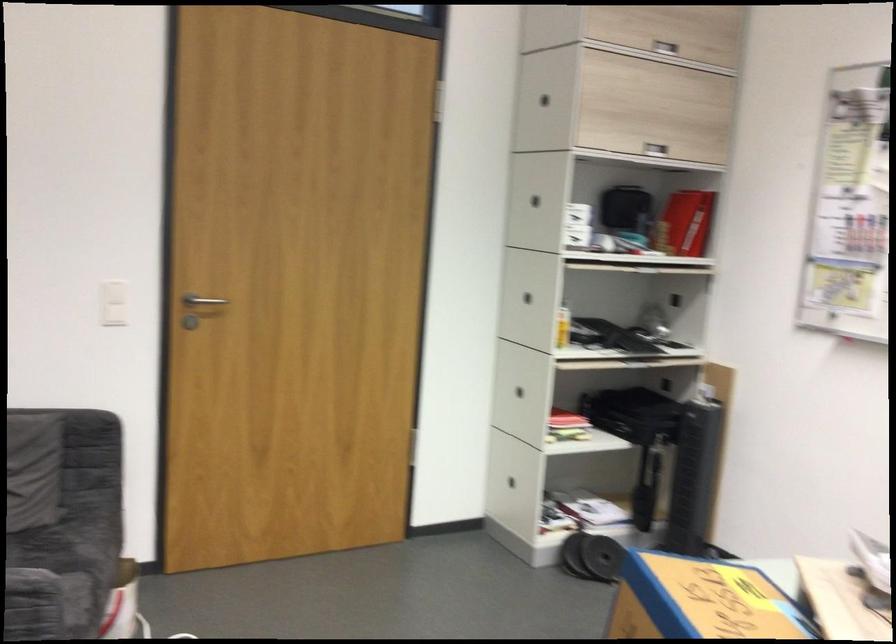
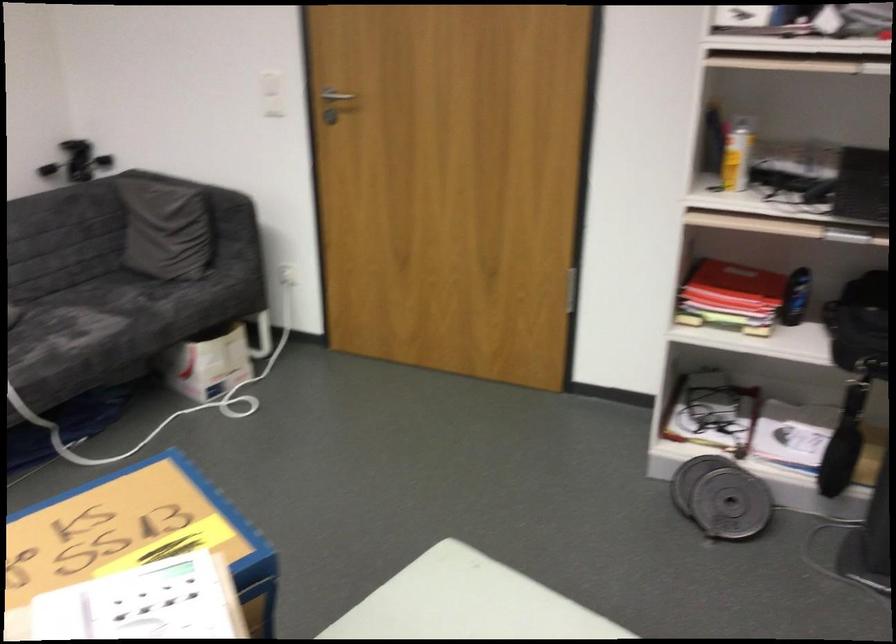
Where in the second image is the point corresponding to (588,411) from the first image?

(796, 297)